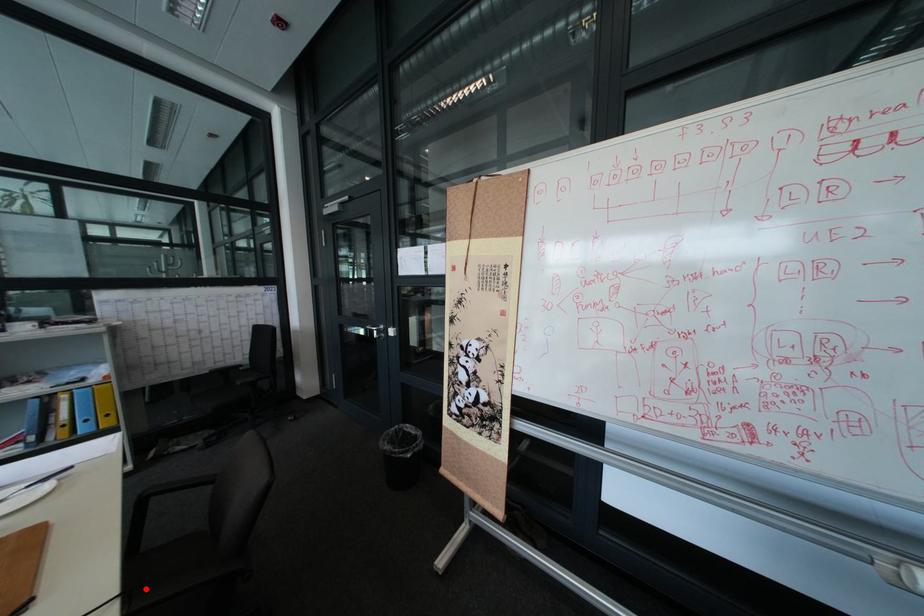
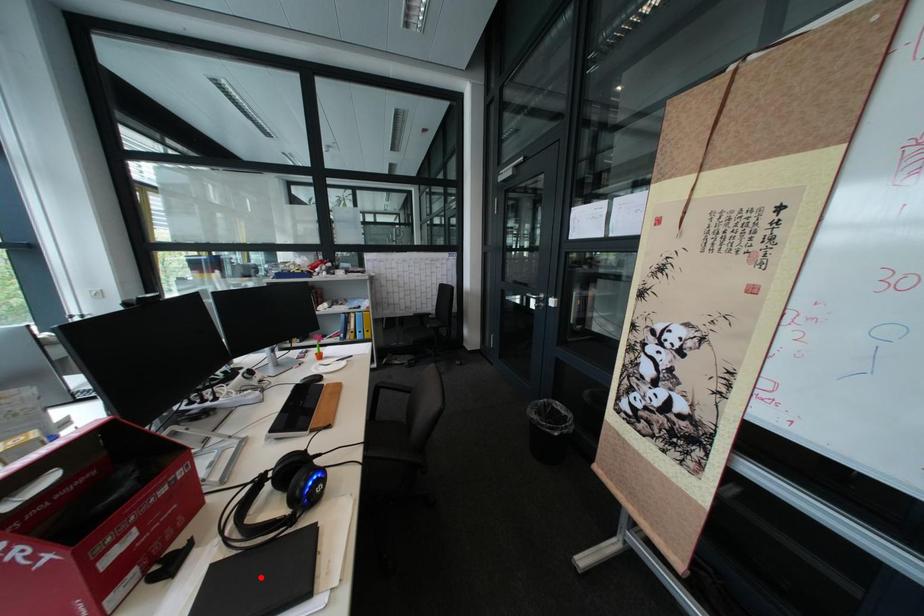
I am providing you with two images of the same scene from different viewpoints. A red point is marked on the first image and another point is marked on the second image. Is the marked point in image1 the same physical position as the marked point in image2?

No